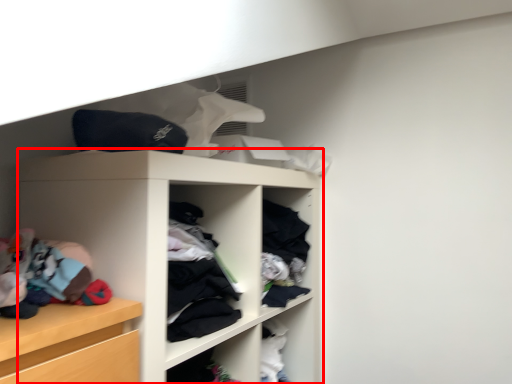
Question: From the image's perspective, what is the correct spatial relationship of shelf (annotated by the red box) in relation to clothing?

Choices:
 (A) below
 (B) above

Answer: (A)